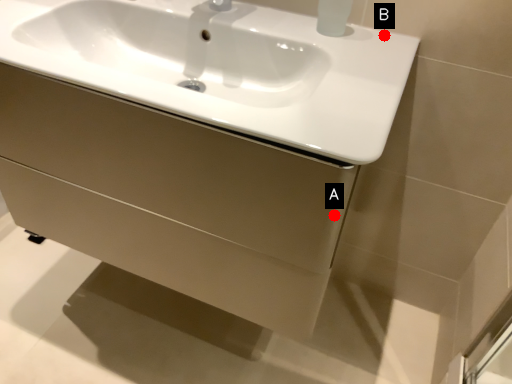
Question: Two points are circled on the image, labeled by A and B beside each circle. Which of the following is the closest to the observer?

Choices:
 (A) A is closer
 (B) B is closer

Answer: (A)